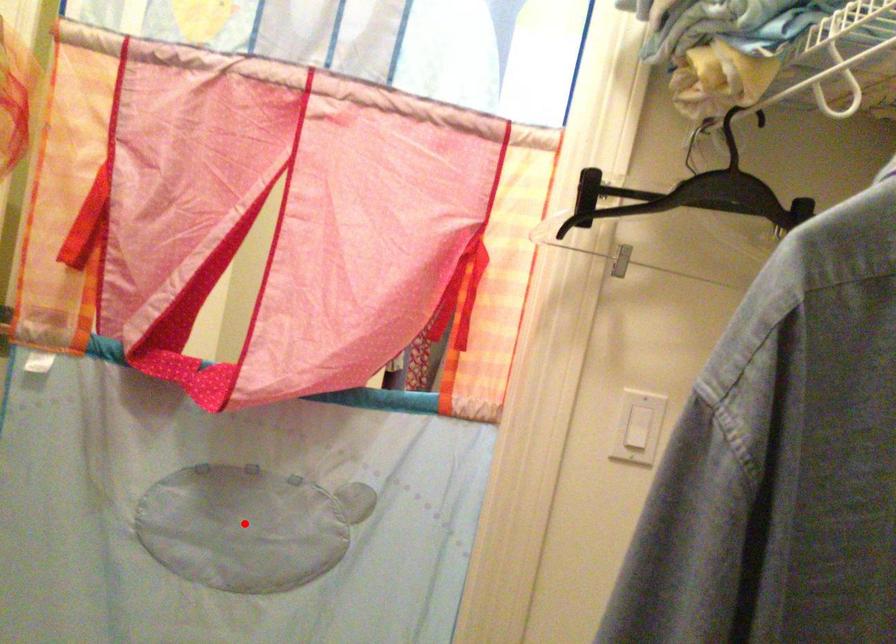
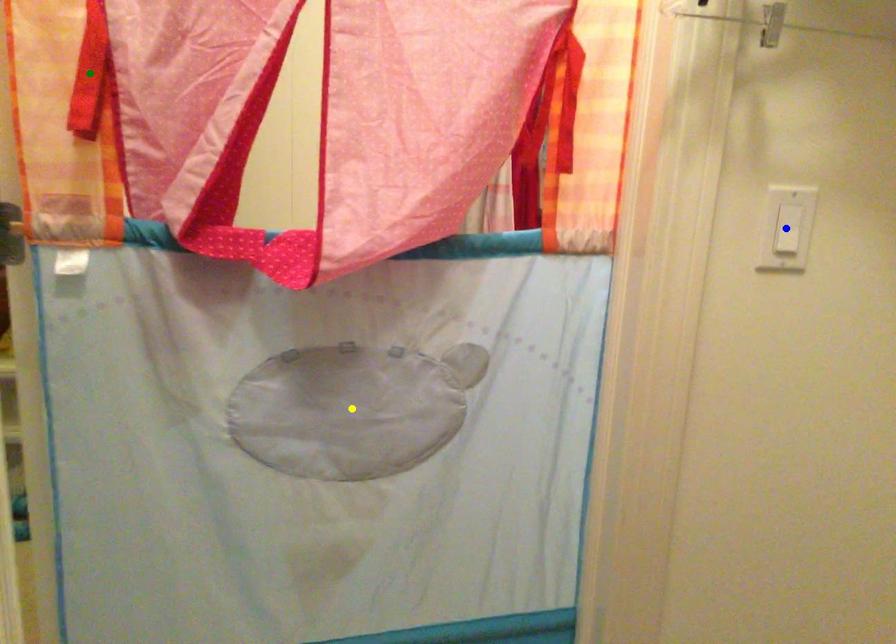
Question: I am providing you with two images of the same scene from different viewpoints. A red point is marked on the first image. You are given multiple points on the second image. Which spot in image 2 lines up with the point in image 1?

Choices:
 (A) yellow point
 (B) green point
 (C) blue point

Answer: (A)